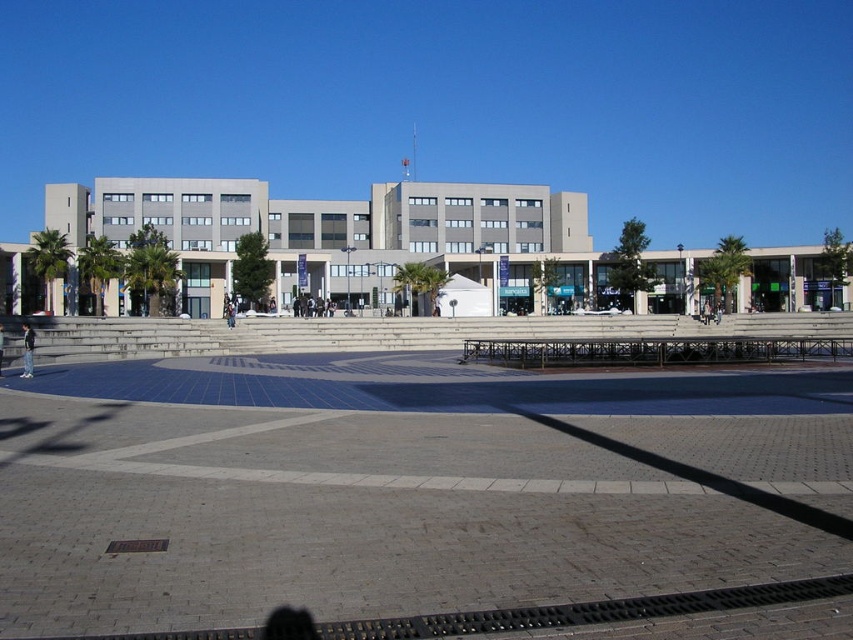
You are standing at the base of the plaza and want to reach the raised platform. According to the image, where are the concrete steps at center located?

The concrete steps at center are located at point (401,468).

Consider the image. You are a delivery person with a cart that is 10 feet wide. You need to move from the concrete steps at center to the brick pavement at lower center. Is there enough space between them for your cart to pass through?

The concrete steps at center and brick pavement at lower center are 70.41 feet apart from each other. Since your cart is only 10 feet wide, there is more than enough space for it to pass through between them.